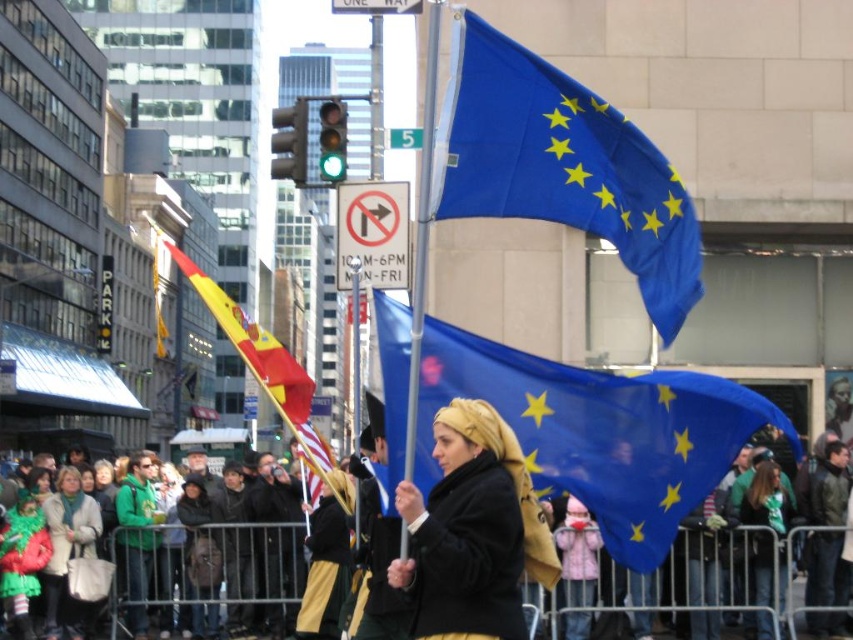
Based on the photo, you are a pedestrian standing in the street scene and want to hand the black matte coat at center to someone behind you. Can you do this without moving the blue fabric flag at center?

The blue fabric flag at center is further to the viewer than black matte coat at center, meaning the coat is closer to you. Therefore, you can reach behind yourself to hand the coat to someone behind without disturbing the flag.

You are a pedestrian standing in the street scene. You see the blue fabric flag at center and the black matte coat at center. Which object is higher from the ground?

The blue fabric flag at center is above the black matte coat at center, so the blue fabric flag at center is higher from the ground.

You are a photographer trying to capture both the blue fabric flag at center and the blue fabric flag at upper center in a single shot. Given their positions and sizes, can you fit both flags into the frame without cropping either of them?

The blue fabric flag at center might be wider than blue fabric flag at upper center, so it depends on the camera angle and zoom level. If the wider flag at center doesn not occupy too much of the frame horizontally, both could potentially fit. However, if the width difference is significant, it might require adjusting the camera position to ensure both are fully visible.